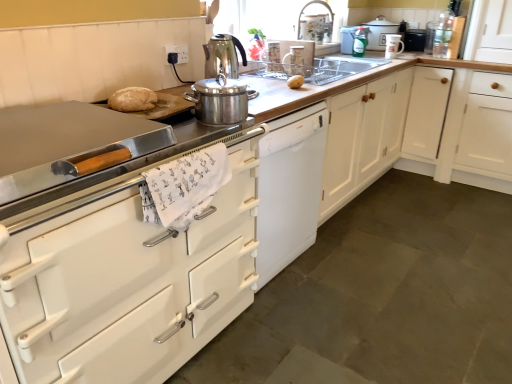
Question: Does stainless steel kettle at center, the fifth kitchen appliance positioned from the back, lie in front of clear glass sink at center?

Choices:
 (A) no
 (B) yes

Answer: (B)

Question: From the image's perspective, is stainless steel kettle at center, which appears as the 2th kitchen appliance when viewed from the front, under clear glass sink at center?

Choices:
 (A) yes
 (B) no

Answer: (A)

Question: Can you confirm if stainless steel kettle at center, the fifth kitchen appliance positioned from the back, is positioned to the left of clear glass sink at center?

Choices:
 (A) no
 (B) yes

Answer: (B)

Question: Is stainless steel kettle at center, the fifth kitchen appliance positioned from the back, in contact with clear glass sink at center?

Choices:
 (A) no
 (B) yes

Answer: (A)

Question: Does stainless steel kettle at center, which appears as the 2th kitchen appliance when viewed from the front, have a greater height compared to clear glass sink at center?

Choices:
 (A) yes
 (B) no

Answer: (A)

Question: From a real-world perspective, does stainless steel kettle at center, acting as the 1th kitchen appliance starting from the left, sit lower than clear glass sink at center?

Choices:
 (A) no
 (B) yes

Answer: (A)

Question: Considering the relative sizes of white wood cabinet at right, placed as the 1th cabinetry when sorted from right to left, and white glossy cabinet at left, acting as the 2th cabinetry starting from the right, in the image provided, is white wood cabinet at right, placed as the 1th cabinetry when sorted from right to left, taller than white glossy cabinet at left, acting as the 2th cabinetry starting from the right,?

Choices:
 (A) yes
 (B) no

Answer: (A)

Question: Would you say white wood cabinet at right, which is the 1th cabinetry from back to front, is a long distance from white glossy cabinet at left, which appears as the 1th cabinetry when viewed from the front?

Choices:
 (A) no
 (B) yes

Answer: (B)

Question: Is white wood cabinet at right, placed as the 1th cabinetry when sorted from right to left, wider than white glossy cabinet at left, the second cabinetry from the top?

Choices:
 (A) yes
 (B) no

Answer: (B)

Question: Is white wood cabinet at right, which appears as the 2th cabinetry when viewed from the front, surrounding white glossy cabinet at left, which appears as the 1th cabinetry when viewed from the front?

Choices:
 (A) yes
 (B) no

Answer: (B)

Question: Considering the relative sizes of white wood cabinet at right, which appears as the 2th cabinetry when viewed from the front, and white glossy cabinet at left, which appears as the 1th cabinetry when viewed from the front, in the image provided, is white wood cabinet at right, which appears as the 2th cabinetry when viewed from the front, shorter than white glossy cabinet at left, which appears as the 1th cabinetry when viewed from the front,?

Choices:
 (A) no
 (B) yes

Answer: (A)

Question: Does white wood cabinet at right, which ranks as the 2th cabinetry in left-to-right order, appear on the right side of white glossy cabinet at left, the second cabinetry in the back-to-front sequence?

Choices:
 (A) no
 (B) yes

Answer: (B)

Question: Does green glossy spray bottle at upper center, the third kitchen appliance from the right, have a greater width compared to white ceramic mug at upper right, the fifth kitchen appliance in the left-to-right sequence?

Choices:
 (A) no
 (B) yes

Answer: (A)